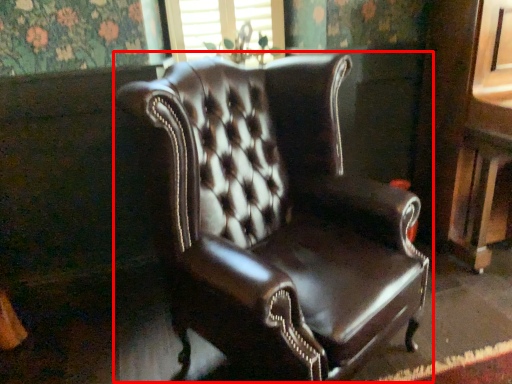
Question: Where is chair (annotated by the red box) located in relation to window frame in the image?

Choices:
 (A) right
 (B) left

Answer: (A)